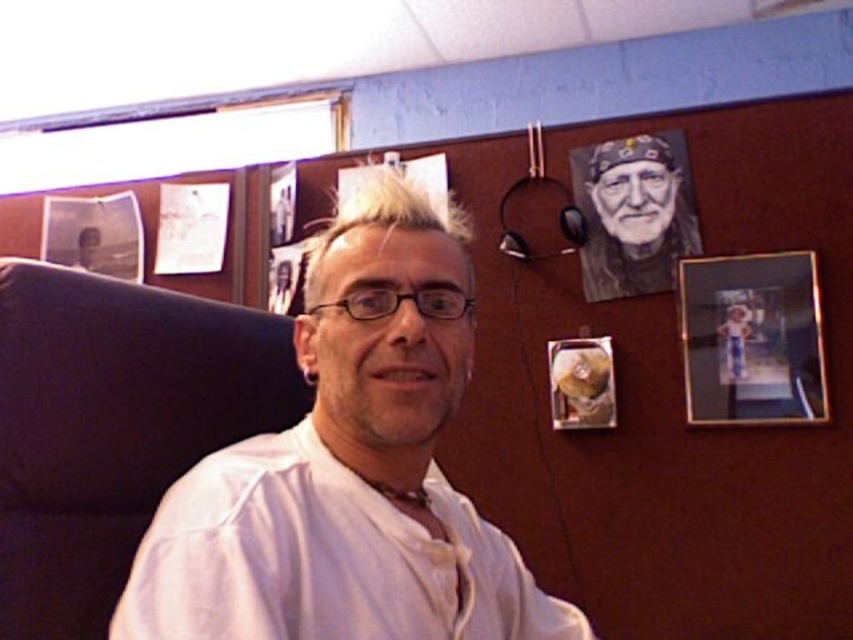
Can you confirm if white matte shirt at center is smaller than charcoal sketch portrait at upper right?

No.

Based on the photo, which is below, white matte shirt at center or charcoal sketch portrait at upper right?

Positioned lower is white matte shirt at center.

Between point (305, 372) and point (583, 268), which one is positioned in front?

Point (305, 372) is in front.

Identify the location of white matte shirt at center. Image resolution: width=853 pixels, height=640 pixels. (349, 468).

Does white matte shirt at center appear under gold metallic photo frame at upper right?

Correct, white matte shirt at center is located below gold metallic photo frame at upper right.

Can you confirm if white matte shirt at center is positioned above gold metallic photo frame at upper right?

Actually, white matte shirt at center is below gold metallic photo frame at upper right.

Between point (177, 637) and point (798, 278), which one is positioned behind?

The point (798, 278) is behind.

The height and width of the screenshot is (640, 853). Find the location of `white matte shirt at center`. white matte shirt at center is located at coordinates (349, 468).

Between point (720, 300) and point (656, 184), which one is positioned in front?

Positioned in front is point (720, 300).

Can you confirm if gold metallic photo frame at upper right is smaller than charcoal sketch portrait at upper right?

No, gold metallic photo frame at upper right is not smaller than charcoal sketch portrait at upper right.

At what (x,y) coordinates should I click in order to perform the action: click on gold metallic photo frame at upper right. Please return your answer as a coordinate pair (x, y). The image size is (853, 640). Looking at the image, I should click on (752, 339).